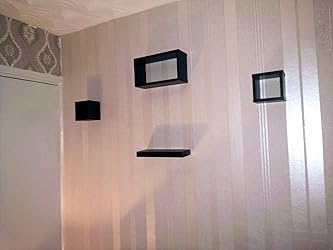
At what (x,y) coordinates should I click in order to perform the action: click on light shining on the wall. Please return your answer as a coordinate pair (x, y). The width and height of the screenshot is (333, 250). Looking at the image, I should click on (118, 167).